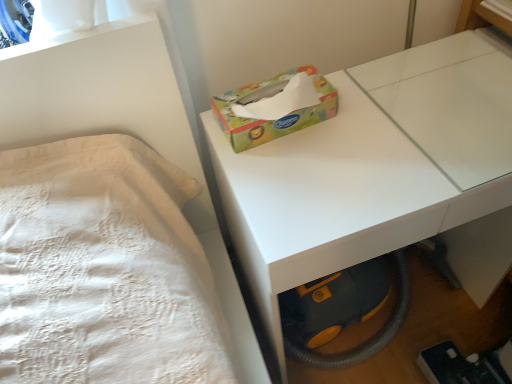
Describe the element at coordinates (382, 174) in the screenshot. I see `white glossy table at center` at that location.

Locate an element on the screen. The image size is (512, 384). white glossy table at center is located at coordinates (382, 174).

What do you see at coordinates (275, 107) in the screenshot?
I see `multicolored cardboard tissue box at center` at bounding box center [275, 107].

The width and height of the screenshot is (512, 384). What are the coordinates of `multicolored cardboard tissue box at center` in the screenshot? It's located at (275, 107).

Measure the distance between multicolored cardboard tissue box at center and camera.

The distance of multicolored cardboard tissue box at center from camera is 31.04 inches.

Where is `white glossy table at center`? The height and width of the screenshot is (384, 512). white glossy table at center is located at coordinates (382, 174).

Does multicolored cardboard tissue box at center appear on the left side of white glossy table at center?

Yes, multicolored cardboard tissue box at center is to the left of white glossy table at center.

Is the position of multicolored cardboard tissue box at center more distant than that of white glossy table at center?

That is True.

Is point (274, 85) closer to viewer compared to point (439, 183)?

That is False.

From the image's perspective, is multicolored cardboard tissue box at center above or below white glossy table at center?

Based on their image positions, multicolored cardboard tissue box at center is located above white glossy table at center.

From a real-world perspective, is multicolored cardboard tissue box at center over white glossy table at center?

Correct, in the physical world, multicolored cardboard tissue box at center is higher than white glossy table at center.

Is multicolored cardboard tissue box at center wider than white glossy table at center?

In fact, multicolored cardboard tissue box at center might be narrower than white glossy table at center.

Can you confirm if multicolored cardboard tissue box at center is shorter than white glossy table at center?

Correct, multicolored cardboard tissue box at center is not as tall as white glossy table at center.

Considering the relative sizes of multicolored cardboard tissue box at center and white glossy table at center in the image provided, is multicolored cardboard tissue box at center smaller than white glossy table at center?

Correct, multicolored cardboard tissue box at center occupies less space than white glossy table at center.

Looking at this image, which is correct: multicolored cardboard tissue box at center is inside white glossy table at center, or outside of it?

multicolored cardboard tissue box at center is not enclosed by white glossy table at center.

Is multicolored cardboard tissue box at center directly adjacent to white glossy table at center?

multicolored cardboard tissue box at center is not next to white glossy table at center, and they're not touching.

Is multicolored cardboard tissue box at center looking in the opposite direction of white glossy table at center?

No, multicolored cardboard tissue box at center's orientation is not away from white glossy table at center.

How different are the orientations of multicolored cardboard tissue box at center and white glossy table at center in degrees?

3.73 degrees.

Identify the location of box above the white glossy table at center (from a real-world perspective). (275, 107).

Is white glossy table at center at the left side of multicolored cardboard tissue box at center?

No, white glossy table at center is not to the left of multicolored cardboard tissue box at center.

Which object is closer to the camera, white glossy table at center or multicolored cardboard tissue box at center?

white glossy table at center.

Is point (453, 208) closer or farther from the camera than point (313, 114)?

Point (453, 208) is closer to the camera than point (313, 114).

From the image's perspective, is white glossy table at center on top of multicolored cardboard tissue box at center?

No.

From a real-world perspective, between white glossy table at center and multicolored cardboard tissue box at center, who is vertically higher?

multicolored cardboard tissue box at center is physically above.

Between white glossy table at center and multicolored cardboard tissue box at center, which one has smaller width?

multicolored cardboard tissue box at center.

Considering the relative sizes of white glossy table at center and multicolored cardboard tissue box at center in the image provided, is white glossy table at center taller than multicolored cardboard tissue box at center?

Indeed, white glossy table at center has a greater height compared to multicolored cardboard tissue box at center.

Does white glossy table at center have a larger size compared to multicolored cardboard tissue box at center?

Yes.

Would you say white glossy table at center is inside or outside multicolored cardboard tissue box at center?

white glossy table at center exists outside the volume of multicolored cardboard tissue box at center.

Is there a large distance between white glossy table at center and multicolored cardboard tissue box at center?

white glossy table at center is near multicolored cardboard tissue box at center, not far away.

Is white glossy table at center oriented away from multicolored cardboard tissue box at center?

No, multicolored cardboard tissue box at center is not at the back of white glossy table at center.

Can you tell me how much white glossy table at center and multicolored cardboard tissue box at center differ in facing direction?

3.73 degrees.

Measure the distance from white glossy table at center to multicolored cardboard tissue box at center.

The distance of white glossy table at center from multicolored cardboard tissue box at center is 6.47 inches.

Identify the location of table below the multicolored cardboard tissue box at center (from a real-world perspective). This screenshot has width=512, height=384. (382, 174).

I want to click on table below the multicolored cardboard tissue box at center (from a real-world perspective), so click(382, 174).

Where is `box above the white glossy table at center (from a real-world perspective)`? The image size is (512, 384). box above the white glossy table at center (from a real-world perspective) is located at coordinates (275, 107).